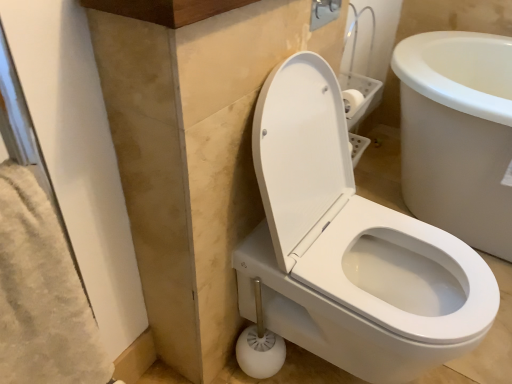
Question: In terms of size, does white glossy toilet at center appear bigger or smaller than white plastic toilet brush at lower center?

Choices:
 (A) small
 (B) big

Answer: (B)

Question: Considering the positions of point (379, 286) and point (250, 281), is point (379, 286) closer or farther from the camera than point (250, 281)?

Choices:
 (A) closer
 (B) farther

Answer: (B)

Question: Would you say white glossy toilet at center is to the left or to the right of white plastic toilet brush at lower center in the picture?

Choices:
 (A) right
 (B) left

Answer: (A)

Question: In terms of width, does white plastic toilet brush at lower center look wider or thinner when compared to white glossy toilet at center?

Choices:
 (A) wide
 (B) thin

Answer: (B)

Question: Considering their positions, is white plastic toilet brush at lower center located in front of or behind white glossy toilet at center?

Choices:
 (A) behind
 (B) front

Answer: (A)

Question: Is point (264, 377) closer or farther from the camera than point (304, 180)?

Choices:
 (A) closer
 (B) farther

Answer: (B)

Question: From the image's perspective, is white plastic toilet brush at lower center positioned above or below white glossy toilet at center?

Choices:
 (A) above
 (B) below

Answer: (B)